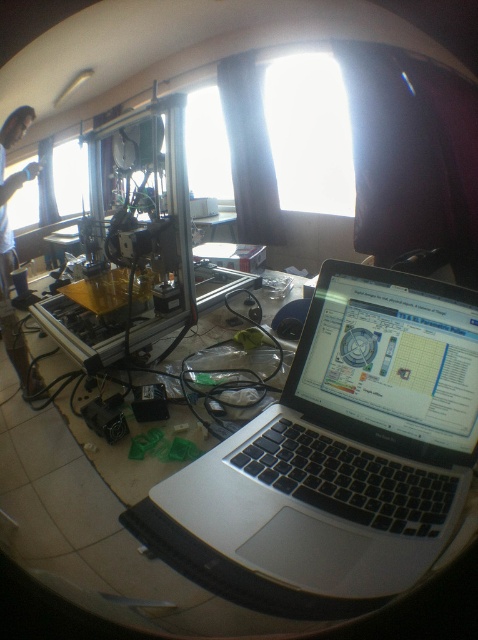
Is point (345, 276) positioned before point (8, 147)?

Yes.

Locate an element on the screen. silver/black keyboard at center is located at coordinates (347, 444).